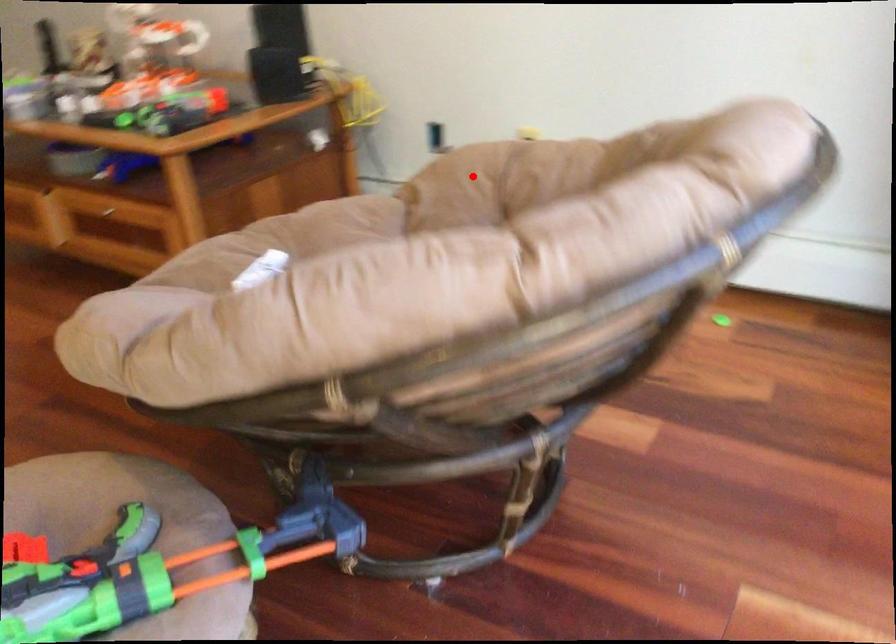
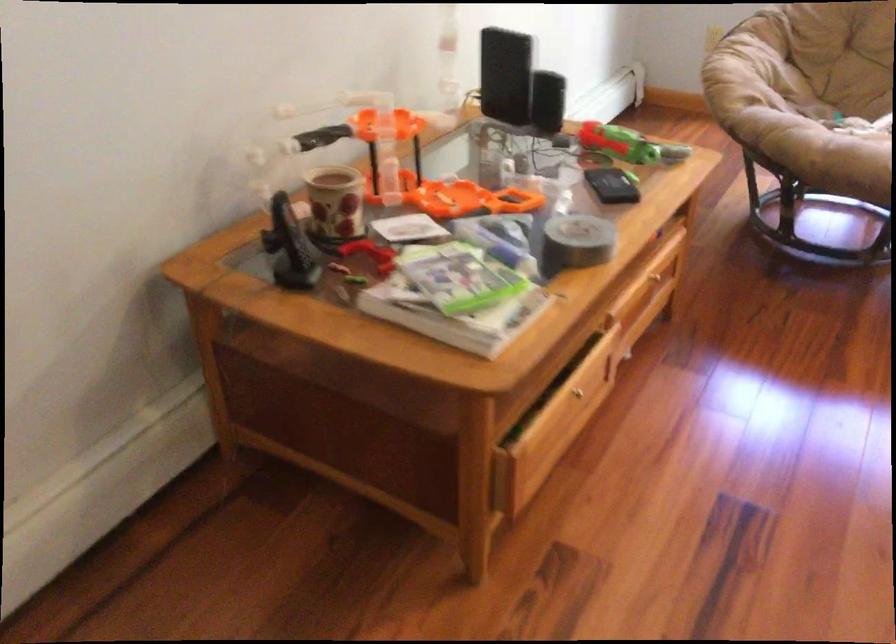
In the second image, find the point that corresponds to the highlighted location in the first image.

(745, 69)